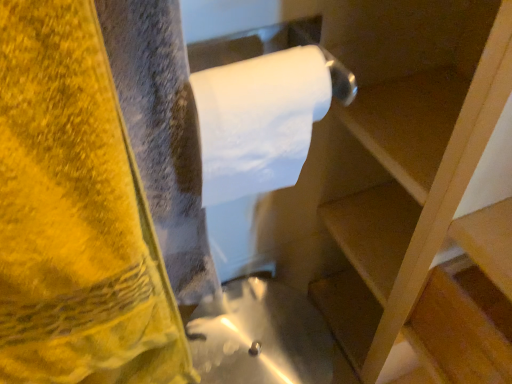
Question: From the image's perspective, is white matte toilet paper at upper center located above or below yellow velvety towel at left?

Choices:
 (A) above
 (B) below

Answer: (A)

Question: Does point (196, 96) appear closer or farther from the camera than point (35, 345)?

Choices:
 (A) closer
 (B) farther

Answer: (A)

Question: Estimate the real-world distances between objects in this image. Which object is closer to the yellow velvety towel at left?

Choices:
 (A) white matte toilet paper at upper center
 (B) wooden at upper right

Answer: (A)

Question: Which object is positioned farthest from the yellow velvety towel at left?

Choices:
 (A) white matte toilet paper at upper center
 (B) wooden at upper right

Answer: (B)